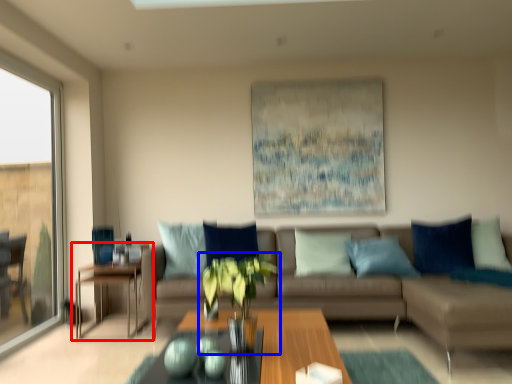
Question: Among these objects, which one is nearest to the camera, table (highlighted by a red box) or houseplant (highlighted by a blue box)?

Choices:
 (A) table
 (B) houseplant

Answer: (B)